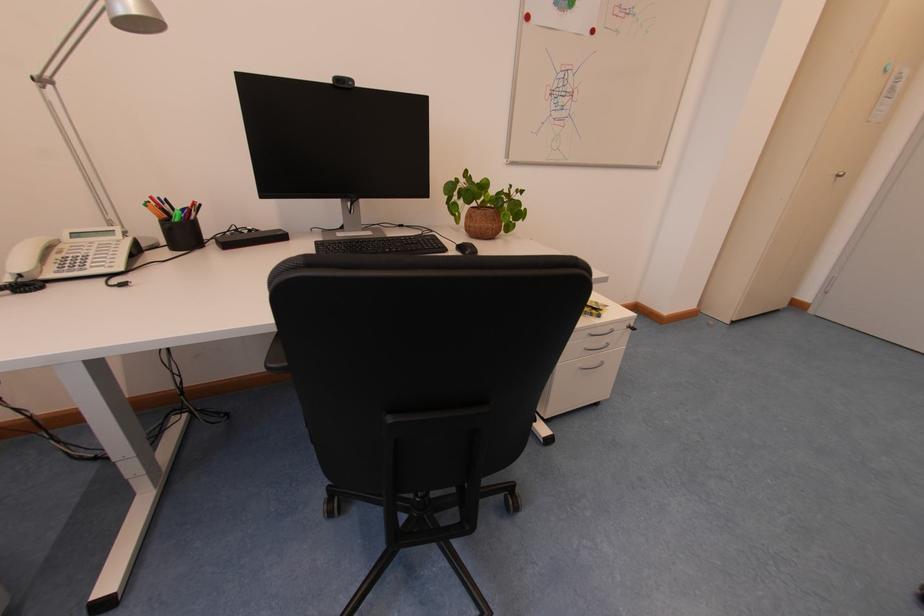
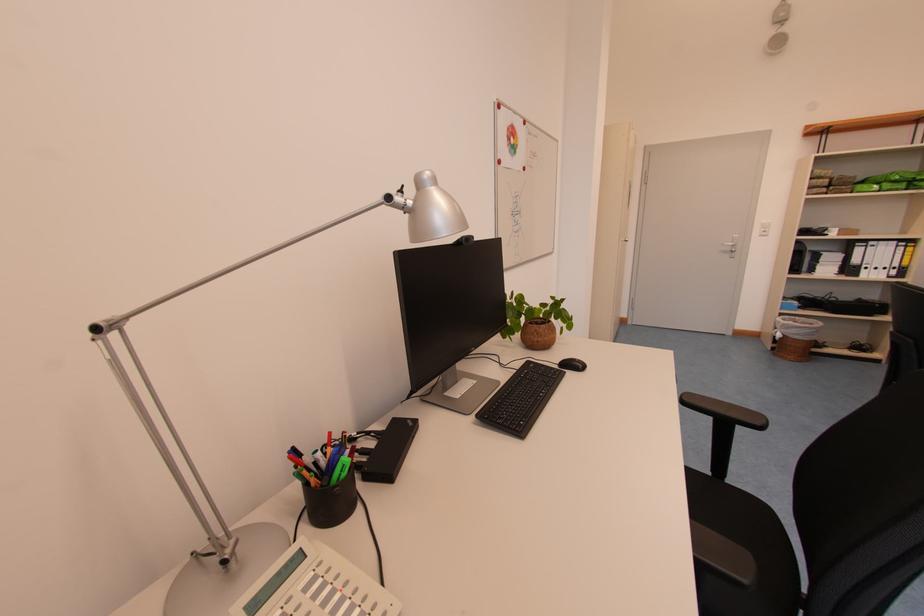
Where in the second image is the point corresponding to [479,227] from the first image?

(546, 342)